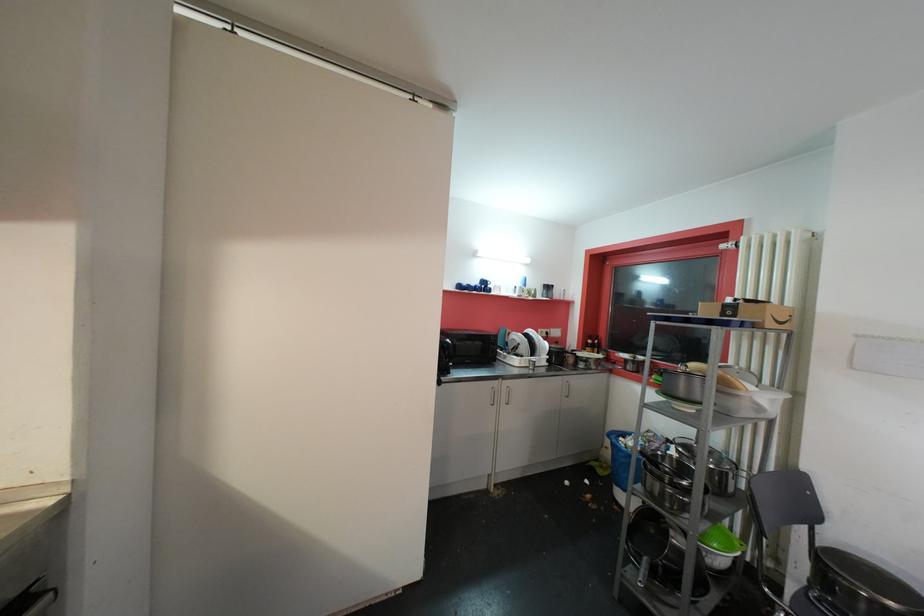
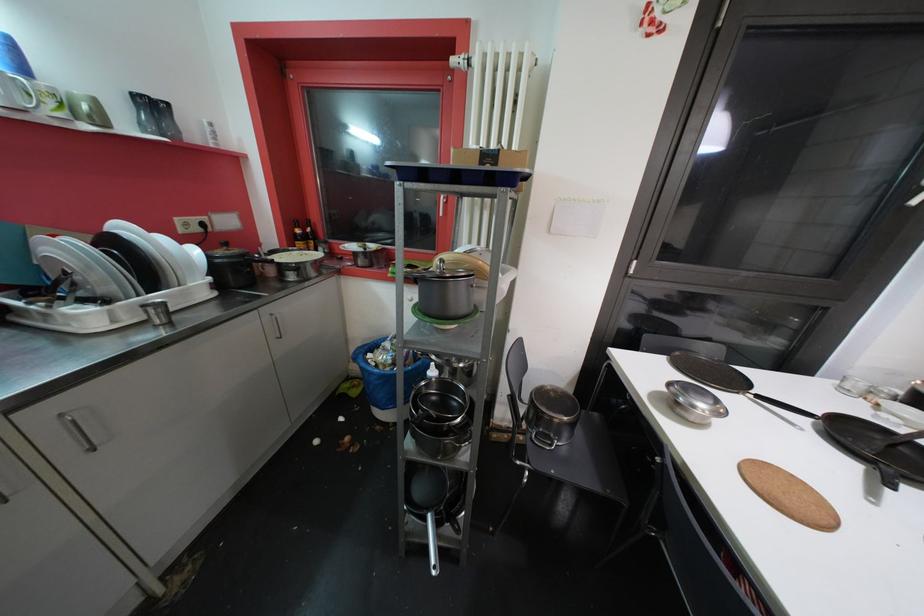
First-person continuous shooting, in which direction is the camera rotating?

The camera's rotation is toward right-down.